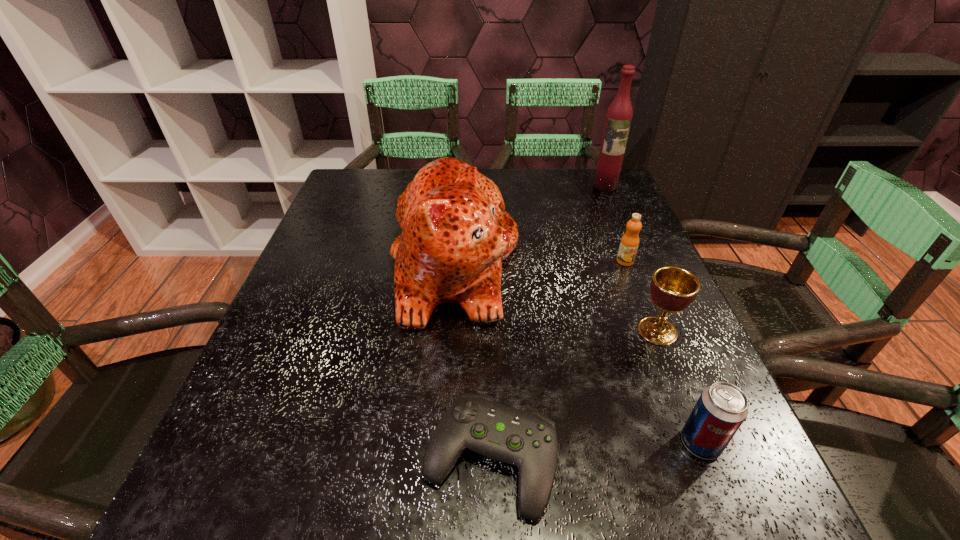
Locate an element on the screen. This screenshot has height=540, width=960. the farthest object is located at coordinates (618, 119).

What are the coordinates of `liquor` in the screenshot? It's located at (618, 119).

Locate an element on the screen. Image resolution: width=960 pixels, height=540 pixels. cat is located at coordinates (455, 231).

The width and height of the screenshot is (960, 540). Identify the location of chalice. (673, 289).

Locate an element on the screen. orange juice is located at coordinates pos(629,243).

Locate an element on the screen. This screenshot has height=540, width=960. beer can is located at coordinates (721, 409).

I want to click on the shortest object, so click(x=527, y=439).

You are a GUI agent. You are given a task and a screenshot of the screen. Output one action in this format:
    pyautogui.click(x=<x>, y=<y>)
    Task: Click on the free location located on the label of the tallest object
    The width and height of the screenshot is (960, 540).
    Given the screenshot: What is the action you would take?
    pyautogui.click(x=634, y=251)

Find the location of `vacant point located on the face of the cat`. vacant point located on the face of the cat is located at coordinates (614, 264).

Locate an element on the screen. vacant region located on the back of the chalice is located at coordinates (617, 233).